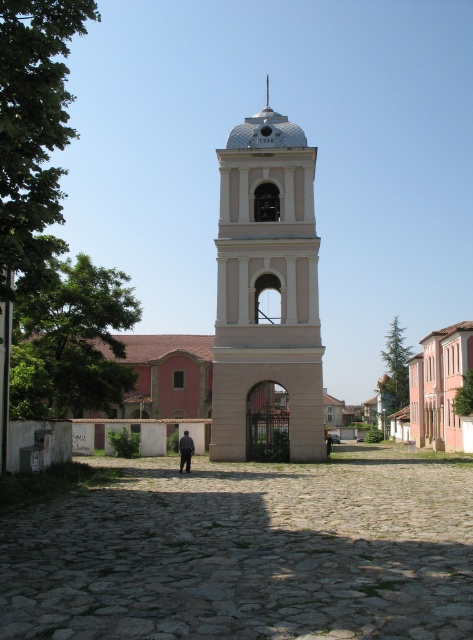
You are standing in the cobblestone courtyard and want to take a photo of both the white smooth bell tower at center and the dark gray fabric at center. Since the bell tower is larger, where should you position yourself to include both in the frame without cropping either?

To include both the white smooth bell tower at center and the dark gray fabric at center in the frame without cropping, position yourself farther away from the bell tower. This will reduce its dominance in the photo, allowing the smaller dark gray fabric at center to be visible alongside it.

From the picture: You are standing in the cobblestone courtyard looking at the bell tower. There are two points marked on the ground. Which point is closer to you, point (187, 445) or point (330, 440)?

Point (187, 445) is closer to the viewer than point (330, 440).

You are standing in the cobblestone courtyard looking at the bell tower. There is a black fabric person at center and a dark gray fabric at center. Which object is wider?

The dark gray fabric at center is wider than the black fabric person at center.